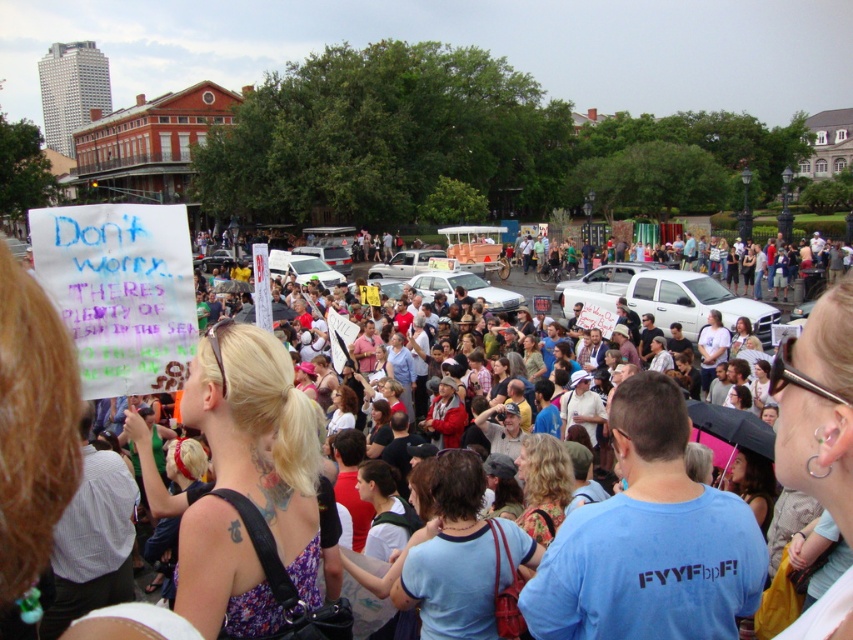
You are a photographer trying to capture the entire multicolored fabric crowd at center in your shot. Given that your camera has a field of view that can cover an area up to point 0.7 on the x and y axes, will the crowd fit within your camera frame?

The multicolored fabric crowd at center is located at point (38,406), which falls within the camera frame that covers up to 0.7 on both axes. Therefore, the crowd will fit within the camera frame.

From the picture: You are a photographer trying to capture a clear shot of the floral fabric dress at center. However, the multicolored fabric crowd at center is blocking your view. Can you estimate if the crowd is taller than the dress?

The multicolored fabric crowd at center is taller than the floral fabric dress at center, so the crowd is blocking the view of the dress.